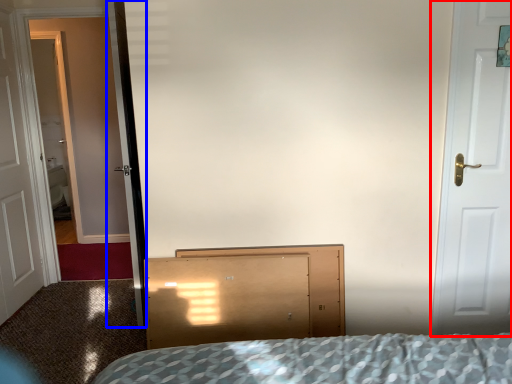
Question: Which object appears farthest to the camera in this image, door (highlighted by a red box) or screen door (highlighted by a blue box)?

Choices:
 (A) door
 (B) screen door

Answer: (B)